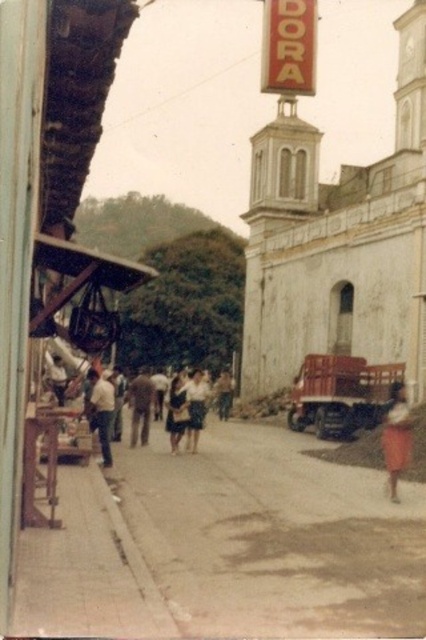
Question: Which point is closer to the camera taking this photo?

Choices:
 (A) (103, 394)
 (B) (293, 396)
 (C) (49, 381)
 (D) (178, 602)

Answer: (D)

Question: Which point is closer to the camera taking this photo?

Choices:
 (A) (374, 387)
 (B) (138, 406)

Answer: (A)

Question: Is white matte shirt at center further to camera compared to light brown fabric skirt at center?

Choices:
 (A) yes
 (B) no

Answer: (B)

Question: Is white matte shirt at center bigger than white cotton shirt at center?

Choices:
 (A) no
 (B) yes

Answer: (B)

Question: Is dull gray asphalt at center above white matte shirt at center?

Choices:
 (A) no
 (B) yes

Answer: (A)

Question: Which object is the closest to the brown fabric shirt at center?

Choices:
 (A) light brown fabric skirt at center
 (B) white matte shirt at center
 (C) white cotton shirt at center
 (D) wooden planks cart at center

Answer: (A)